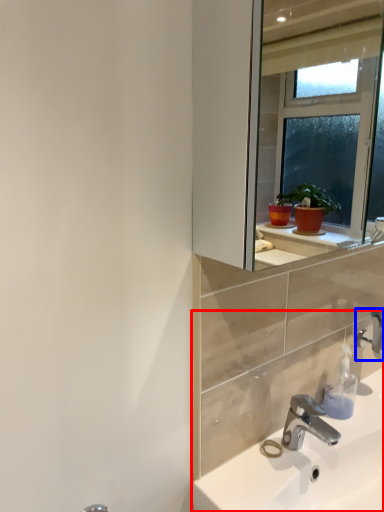
Question: Which of the following is the farthest to the observer, sink (highlighted by a red box) or tap (highlighted by a blue box)?

Choices:
 (A) sink
 (B) tap

Answer: (B)